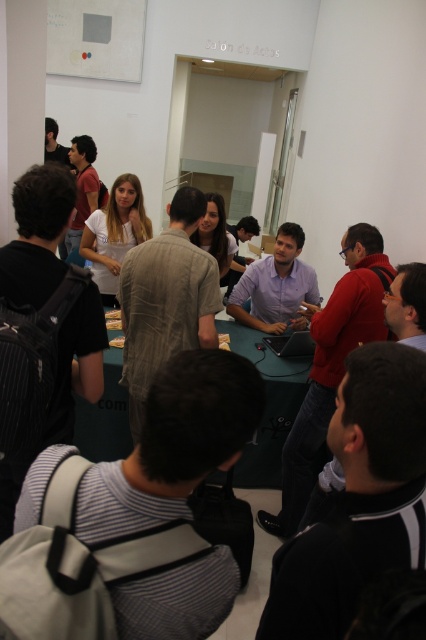
Can you confirm if green fabric table at center is taller than smooth wooden board at center?

Yes, green fabric table at center is taller than smooth wooden board at center.

Is green fabric table at center thinner than smooth wooden board at center?

Incorrect, green fabric table at center's width is not less than smooth wooden board at center's.

Which is in front, point (267, 417) or point (120, 337)?

Point (267, 417) is more forward.

At what (x,y) coordinates should I click in order to perform the action: click on green fabric table at center. Please return your answer as a coordinate pair (x, y). Looking at the image, I should click on (267, 406).

Does green fabric table at center appear on the left side of light brown hair at center?

No, green fabric table at center is not to the left of light brown hair at center.

Can you confirm if green fabric table at center is thinner than light brown hair at center?

No.

Is point (106, 374) positioned in front of point (103, 241)?

Yes, point (106, 374) is in front of point (103, 241).

At what (x,y) coordinates should I click in order to perform the action: click on green fabric table at center. Please return your answer as a coordinate pair (x, y). Looking at the image, I should click on (267, 406).

Between light brown hair at center and smooth wooden board at center, which one appears on the left side from the viewer's perspective?

Positioned to the left is light brown hair at center.

Does point (89, 220) lie in front of point (115, 339)?

No, (89, 220) is further to viewer.

Where is `light brown hair at center`? The width and height of the screenshot is (426, 640). light brown hair at center is located at coordinates (115, 234).